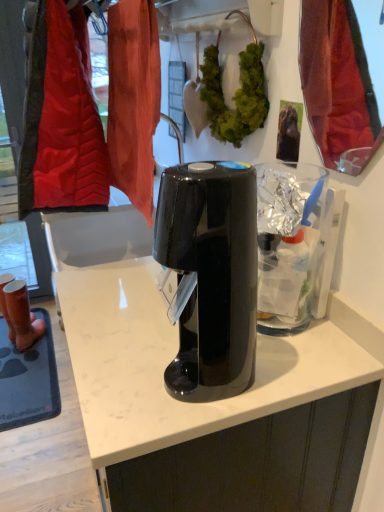
Question: Is shiny red fabric at upper right located within matte brown boots at left?

Choices:
 (A) yes
 (B) no

Answer: (B)

Question: Does matte brown boots at left lie behind shiny red fabric at upper right?

Choices:
 (A) yes
 (B) no

Answer: (A)

Question: Is matte brown boots at left oriented away from shiny red fabric at upper right?

Choices:
 (A) no
 (B) yes

Answer: (A)

Question: From a real-world perspective, is matte brown boots at left below shiny red fabric at upper right?

Choices:
 (A) yes
 (B) no

Answer: (A)

Question: Can you confirm if matte brown boots at left is shorter than shiny red fabric at upper right?

Choices:
 (A) no
 (B) yes

Answer: (A)

Question: Could you tell me if matte brown boots at left is turned towards shiny red fabric at upper right?

Choices:
 (A) yes
 (B) no

Answer: (B)

Question: Are black glossy coffee maker at center and green leafy plant at center located far from each other?

Choices:
 (A) yes
 (B) no

Answer: (B)

Question: Is black glossy coffee maker at center at the left side of green leafy plant at center?

Choices:
 (A) yes
 (B) no

Answer: (A)

Question: Is black glossy coffee maker at center closer to camera compared to green leafy plant at center?

Choices:
 (A) no
 (B) yes

Answer: (B)

Question: From the image's perspective, is black glossy coffee maker at center located above green leafy plant at center?

Choices:
 (A) no
 (B) yes

Answer: (A)

Question: From a real-world perspective, is black glossy coffee maker at center on top of green leafy plant at center?

Choices:
 (A) yes
 (B) no

Answer: (B)

Question: Can you confirm if black glossy coffee maker at center is thinner than green leafy plant at center?

Choices:
 (A) no
 (B) yes

Answer: (A)

Question: Is green leafy plant at center thinner than black glossy coffee maker at center?

Choices:
 (A) yes
 (B) no

Answer: (A)